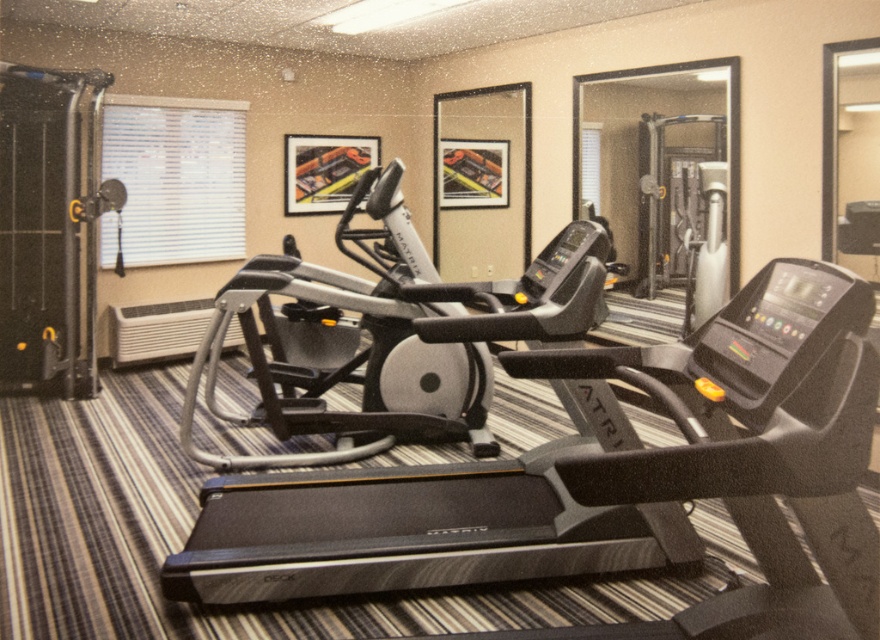
You are standing in the gym and want to place a new piece of equipment between the two points labeled point (809, 456) and point (210, 330). Which point should the equipment be closer to in order to be nearer to the camera?

The equipment should be placed closer to point (809, 456) because it is closer to the camera than point (210, 330).

You are a fitness instructor preparing for a class. You need to move from the entrance to the black plastic treadmill at center. Is the silver metallic elliptical trainer at center blocking your path?

The black plastic treadmill at center is in front of the silver metallic elliptical trainer at center, so the elliptical trainer is behind the treadmill and not blocking the path.